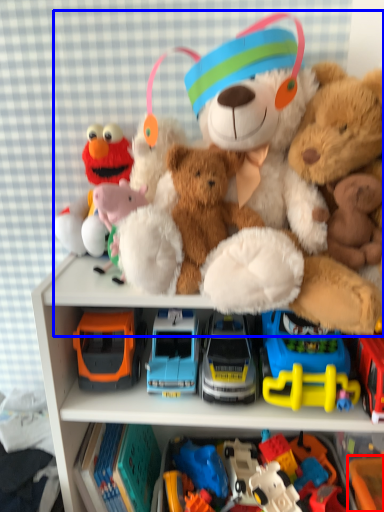
Question: Which object is further to the camera taking this photo, toy (highlighted by a red box) or teddy bear (highlighted by a blue box)?

Choices:
 (A) toy
 (B) teddy bear

Answer: (A)